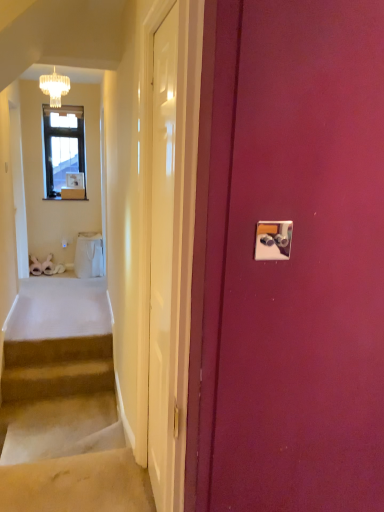
Question: Is white glossy door at center, the 1th door positioned from the left, oriented away from carpeted stairs at lower left, marked as the second stairs in a bottom-to-top arrangement?

Choices:
 (A) no
 (B) yes

Answer: (A)

Question: Is white glossy door at center, acting as the second door starting from the right, outside of carpeted stairs at lower left, marked as the second stairs in a bottom-to-top arrangement?

Choices:
 (A) yes
 (B) no

Answer: (A)

Question: From a real-world perspective, is white glossy door at center, the 1th door positioned from the left, located higher than carpeted stairs at lower left, which ranks as the first stairs in top-to-bottom order?

Choices:
 (A) yes
 (B) no

Answer: (A)

Question: From the image's perspective, is white glossy door at center, the 1th door positioned from the left, over carpeted stairs at lower left, which ranks as the first stairs in top-to-bottom order?

Choices:
 (A) no
 (B) yes

Answer: (B)

Question: Does white glossy door at center, the 1th door positioned from the left, have a lesser height compared to carpeted stairs at lower left, which ranks as the first stairs in top-to-bottom order?

Choices:
 (A) yes
 (B) no

Answer: (B)

Question: Does white glossy door at center, the 1th door positioned from the left, come behind carpeted stairs at lower left, which ranks as the first stairs in top-to-bottom order?

Choices:
 (A) yes
 (B) no

Answer: (B)

Question: Can you confirm if beige carpeted stairs at lower left, which ranks as the second stairs in top-to-bottom order, is wider than white glossy door at center, acting as the second door starting from the right?

Choices:
 (A) yes
 (B) no

Answer: (A)

Question: From a real-world perspective, is beige carpeted stairs at lower left, which ranks as the second stairs in top-to-bottom order, positioned over white glossy door at center, the 1th door positioned from the left, based on gravity?

Choices:
 (A) yes
 (B) no

Answer: (B)

Question: Is beige carpeted stairs at lower left, which is counted as the first stairs, starting from the bottom, positioned behind white glossy door at center, acting as the second door starting from the right?

Choices:
 (A) no
 (B) yes

Answer: (B)

Question: From a real-world perspective, is beige carpeted stairs at lower left, which is counted as the first stairs, starting from the bottom, located beneath white glossy door at center, acting as the second door starting from the right?

Choices:
 (A) no
 (B) yes

Answer: (B)

Question: Can you see beige carpeted stairs at lower left, which ranks as the second stairs in top-to-bottom order, touching white glossy door at center, the 1th door positioned from the left?

Choices:
 (A) no
 (B) yes

Answer: (A)

Question: Can we say beige carpeted stairs at lower left, which is counted as the first stairs, starting from the bottom, lies outside white glossy door at center, the 1th door positioned from the left?

Choices:
 (A) no
 (B) yes

Answer: (B)

Question: From a real-world perspective, is white glossy door at center, the 1th door positioned from the left, under beige carpeted stairs at lower left, which is counted as the first stairs, starting from the bottom?

Choices:
 (A) yes
 (B) no

Answer: (B)